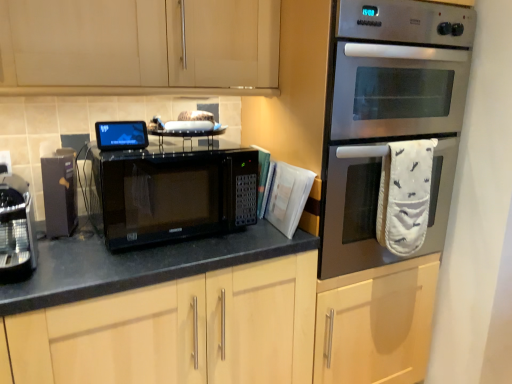
Where is `vacant area to the right of matte black microwave at center, acting as the 3th appliance starting from the left`? This screenshot has height=384, width=512. vacant area to the right of matte black microwave at center, acting as the 3th appliance starting from the left is located at coordinates (163, 149).